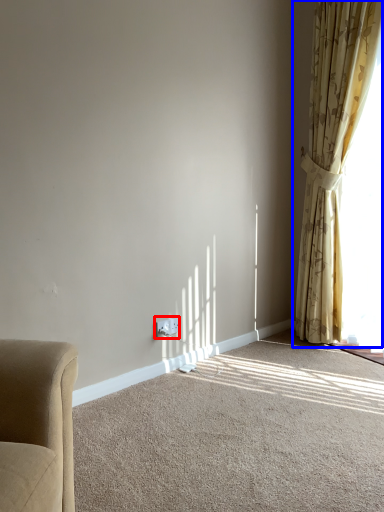
Question: Among these objects, which one is farthest to the camera, electric outlet (highlighted by a red box) or curtain (highlighted by a blue box)?

Choices:
 (A) electric outlet
 (B) curtain

Answer: (A)